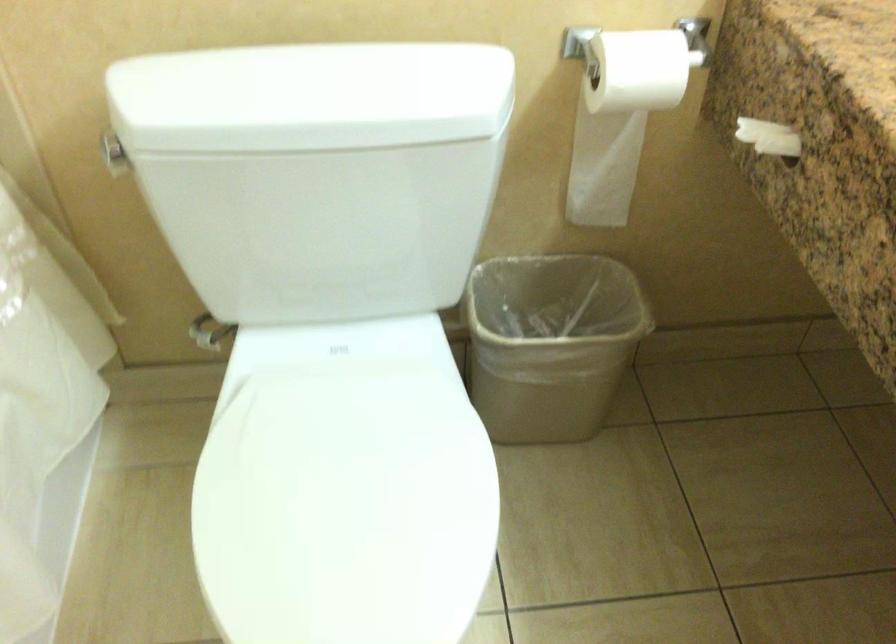
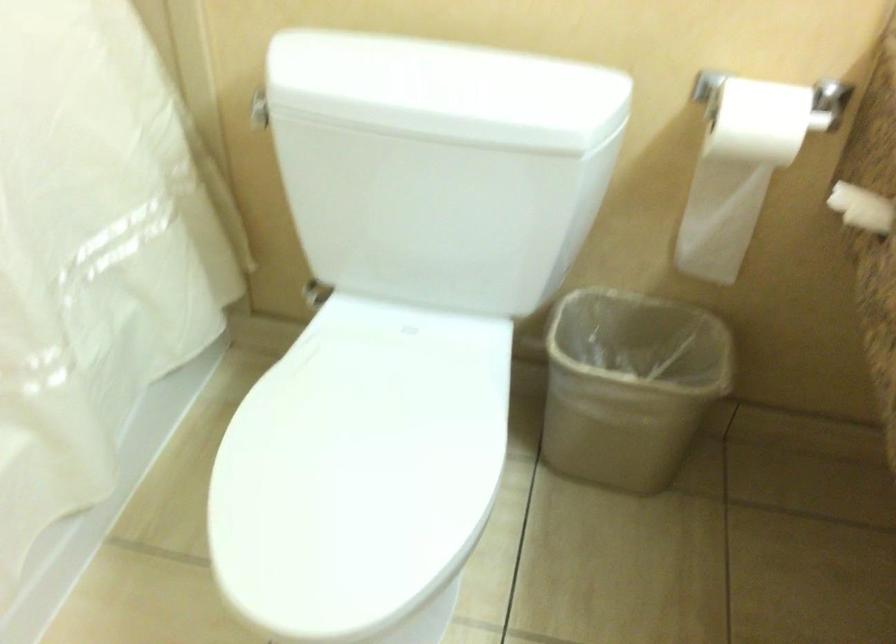
The point at (x=618, y=107) is marked in the first image. Where is the corresponding point in the second image?

(744, 162)